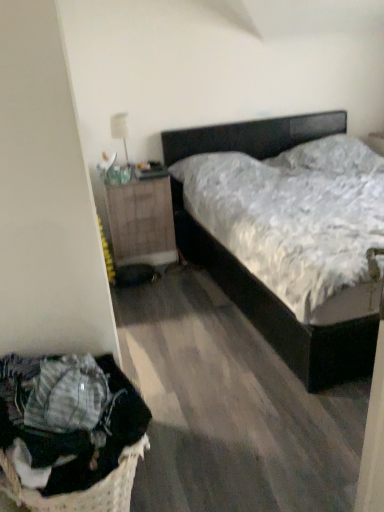
Question: Does point (349, 356) appear closer or farther from the camera than point (51, 410)?

Choices:
 (A) farther
 (B) closer

Answer: (A)

Question: In terms of size, does black matte bed at center appear bigger or smaller than woven fabric laundry basket at lower left?

Choices:
 (A) big
 (B) small

Answer: (A)

Question: Which object is the closest to the woven fabric laundry basket at lower left?

Choices:
 (A) wooden nightstand at left
 (B) black matte bed at center

Answer: (B)

Question: Which of these objects is positioned farthest from the black matte bed at center?

Choices:
 (A) woven fabric laundry basket at lower left
 (B) wooden nightstand at left

Answer: (A)